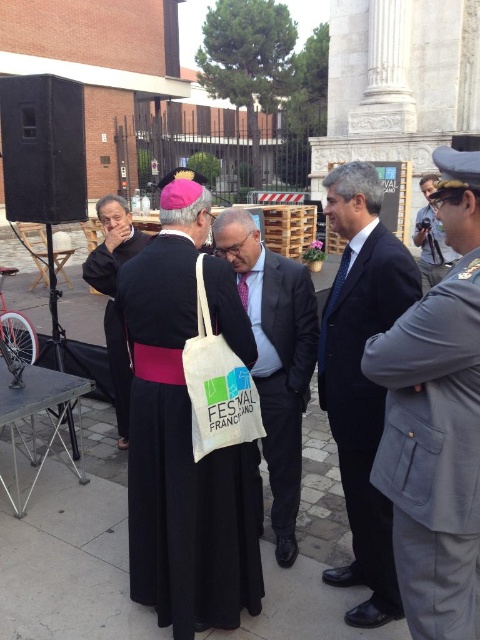
Who is positioned more to the right, dark blue suit at center or black velvet robe at left?

dark blue suit at center

This screenshot has width=480, height=640. Find the location of `dark blue suit at center`. dark blue suit at center is located at coordinates (361, 376).

What do you see at coordinates (361, 376) in the screenshot? I see `dark blue suit at center` at bounding box center [361, 376].

Locate an element on the screen. This screenshot has width=480, height=640. dark blue suit at center is located at coordinates (361, 376).

Looking at this image, is black fabric dress at center to the left of black velvet robe at left from the viewer's perspective?

No, black fabric dress at center is not to the left of black velvet robe at left.

Find the location of a particular element. Image resolution: width=480 pixels, height=640 pixels. black fabric dress at center is located at coordinates (180, 461).

This screenshot has height=640, width=480. Identify the location of black fabric dress at center. (180, 461).

Does point (424, 573) come in front of point (419, 180)?

Yes, point (424, 573) is in front of point (419, 180).

In the scene shown: Does gray uniform at right appear under metallic silver camera at right?

Indeed, gray uniform at right is positioned under metallic silver camera at right.

This screenshot has width=480, height=640. What are the coordinates of `gray uniform at right` in the screenshot? It's located at (435, 422).

Where is `gray uniform at right`? gray uniform at right is located at coordinates (435, 422).